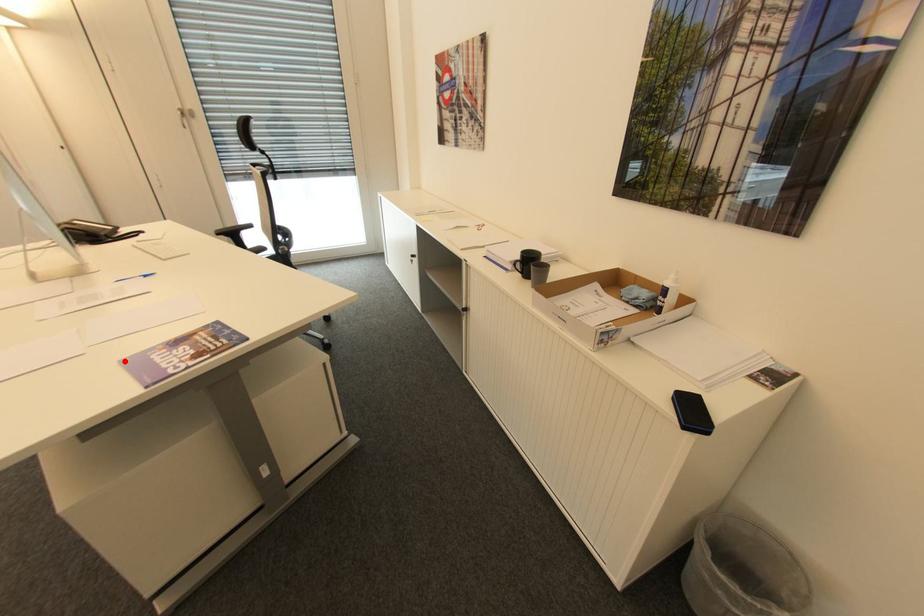
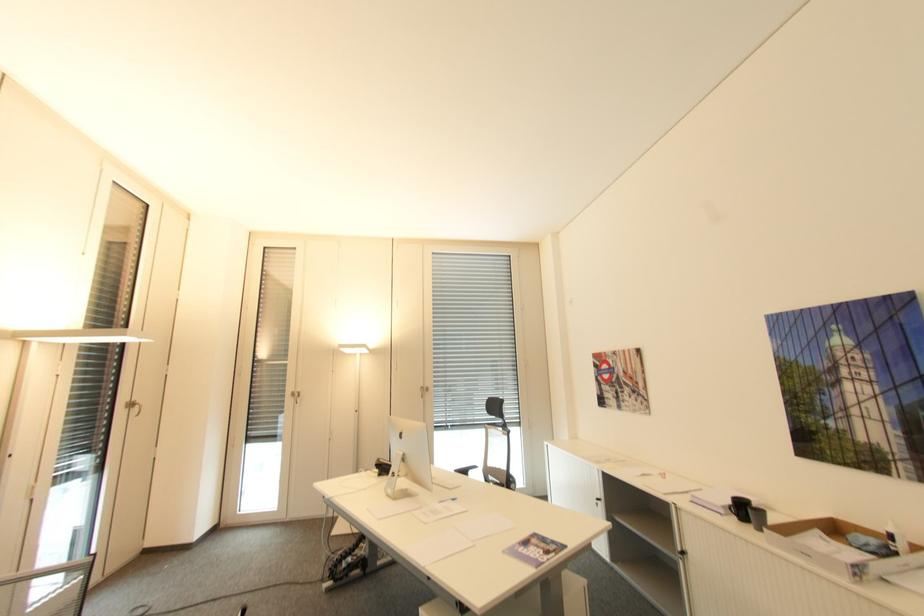
The point at the highlighted location is marked in the first image. Where is the corresponding point in the second image?

(507, 553)